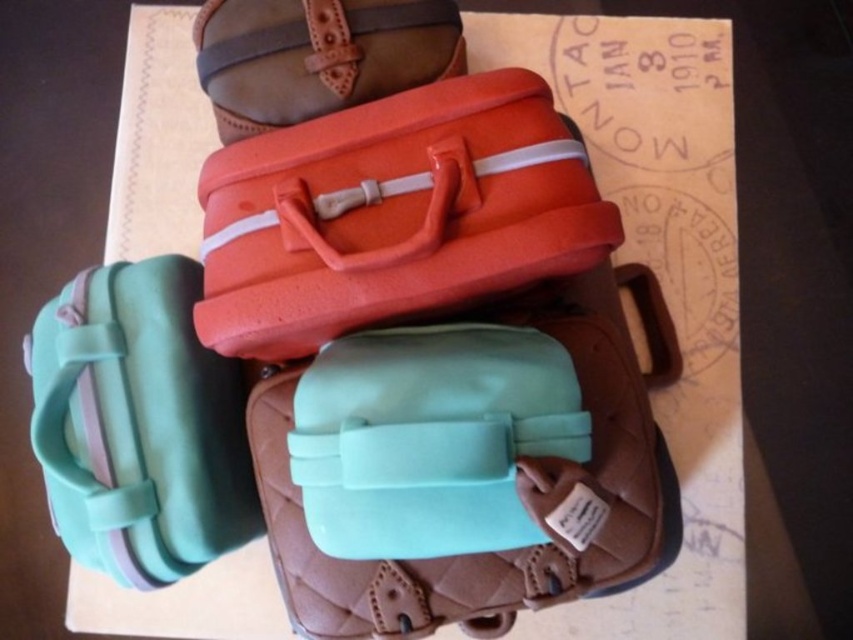
Question: Can you confirm if mint green plastic suitcase at lower left is positioned to the right of matte orange suitcase at upper center?

Choices:
 (A) yes
 (B) no

Answer: (B)

Question: Is mint green plastic suitcase at lower left thinner than matte orange suitcase at upper center?

Choices:
 (A) yes
 (B) no

Answer: (A)

Question: Which point is farther to the camera?

Choices:
 (A) (204, 241)
 (B) (219, 77)
 (C) (74, 333)

Answer: (B)

Question: Which object is closer to the camera taking this photo?

Choices:
 (A) mint green plastic suitcase at lower left
 (B) matte orange suitcase at upper center

Answer: (A)

Question: Which point is closer to the camera taking this photo?

Choices:
 (A) (186, 492)
 (B) (308, 19)

Answer: (A)

Question: Is orange matte suitcase at center in front of matte orange suitcase at upper center?

Choices:
 (A) no
 (B) yes

Answer: (B)